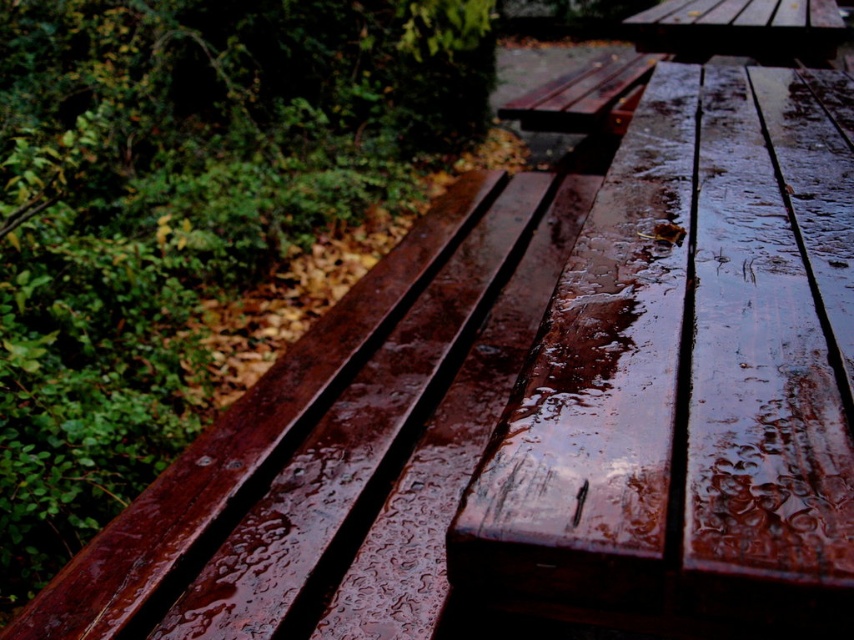
You are a painter who needs to decide which object to paint first based on their size. Given the glossy wood bench at left and the wet wood plank at center, which one should you choose if you want to paint the larger one first?

The glossy wood bench at left is larger in size than the wet wood plank at center, so you should paint the glossy wood bench at left first.

You are a painter who needs to set up an easel between the wet wood plank at center and the wet wood picnic table at upper center. The easel requires at least 2 meters of space to be stable. Based on the scene, can you fit your easel between them?

The wet wood plank at center and the wet wood picnic table at upper center are 1.99 meters apart. Since the easel requires at least 2 meters of space, the distance is insufficient, so the easel cannot be placed between them.

You are a painter who wants to paint the glossy wood bench at left and the wet wood plank at center. Which object should you paint first if you want to follow the standard painting order of starting from the background to the foreground?

You should paint the wet wood plank at center first because the glossy wood bench at left is located above it, meaning the bench is in the foreground and the plank is in the background. Painting the background first is standard practice.